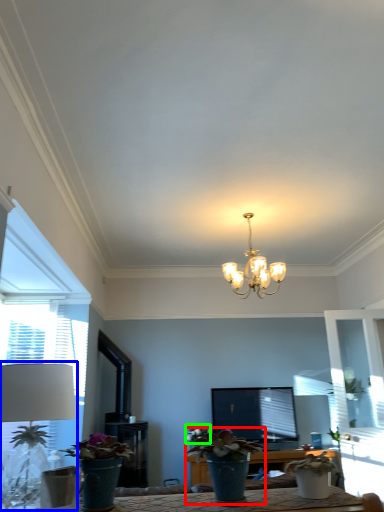
Question: Which object is the farthest from houseplant (highlighted by a red box)? Choose among these: table lamp (highlighted by a blue box) or flower (highlighted by a green box).

Choices:
 (A) table lamp
 (B) flower

Answer: (A)